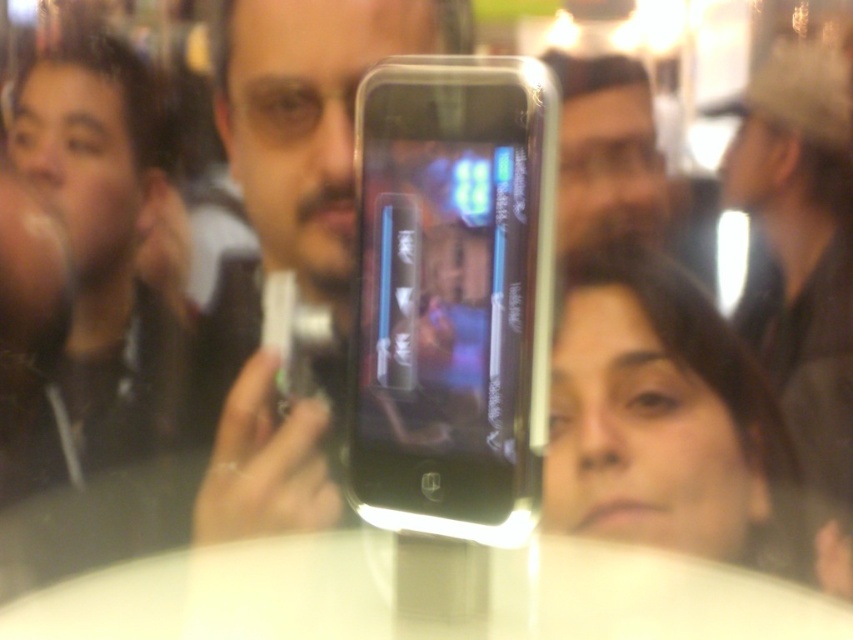
Between white glossy round table at center and dark brown hair at left, which one has more height?

dark brown hair at left

Is white glossy round table at center further to the viewer compared to dark brown hair at left?

No.

Is point (280, 618) closer to viewer compared to point (91, 468)?

Yes, point (280, 618) is in front of point (91, 468).

Where is `white glossy round table at center`? The width and height of the screenshot is (853, 640). white glossy round table at center is located at coordinates (422, 595).

Is matte black phone at center bigger than white glossy round table at center?

Yes.

Between matte black phone at center and white glossy round table at center, which one appears on the left side from the viewer's perspective?

matte black phone at center is more to the left.

Is point (292, 298) in front of point (434, 624)?

No, (292, 298) is behind (434, 624).

Image resolution: width=853 pixels, height=640 pixels. Identify the location of matte black phone at center. (293, 244).

Can you confirm if matte black phone at center is smaller than dark brown hair at left?

No, matte black phone at center is not smaller than dark brown hair at left.

This screenshot has width=853, height=640. What are the coordinates of `matte black phone at center` in the screenshot? It's located at (293, 244).

This screenshot has width=853, height=640. I want to click on matte black phone at center, so click(x=293, y=244).